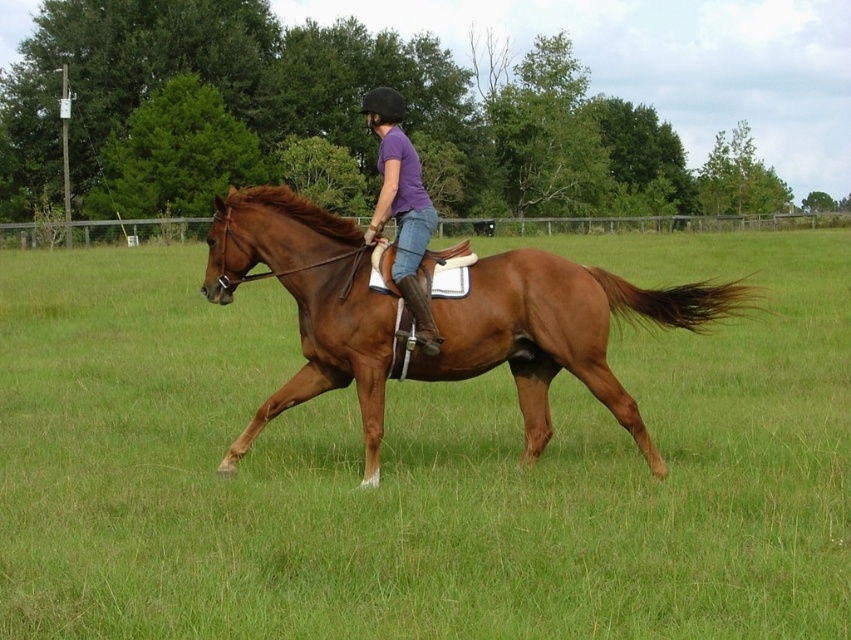
Question: Which object is farther from the camera taking this photo?

Choices:
 (A) brown leather horse at center
 (B) brown glossy horse at center
 (C) purple cotton shirt at center

Answer: (C)

Question: Is brown glossy horse at center wider than purple cotton shirt at center?

Choices:
 (A) yes
 (B) no

Answer: (A)

Question: Which point is closer to the camera?

Choices:
 (A) purple cotton shirt at center
 (B) brown glossy horse at center

Answer: (B)

Question: Which of these objects is positioned farthest from the brown glossy horse at center?

Choices:
 (A) purple cotton shirt at center
 (B) brown leather horse at center

Answer: (B)

Question: Is brown leather horse at center to the left of brown glossy horse at center from the viewer's perspective?

Choices:
 (A) no
 (B) yes

Answer: (B)

Question: Is brown leather horse at center positioned at the back of purple cotton shirt at center?

Choices:
 (A) no
 (B) yes

Answer: (A)